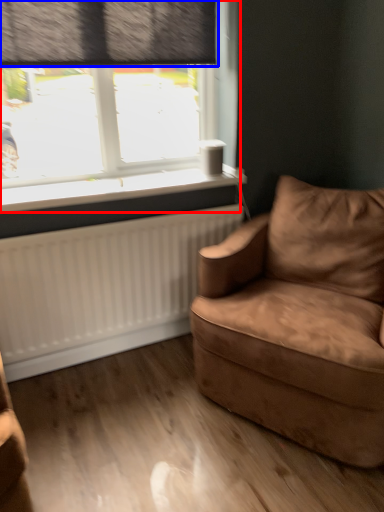
Question: Which of the following is the closest to the observer, window (highlighted by a red box) or curtain (highlighted by a blue box)?

Choices:
 (A) window
 (B) curtain

Answer: (B)